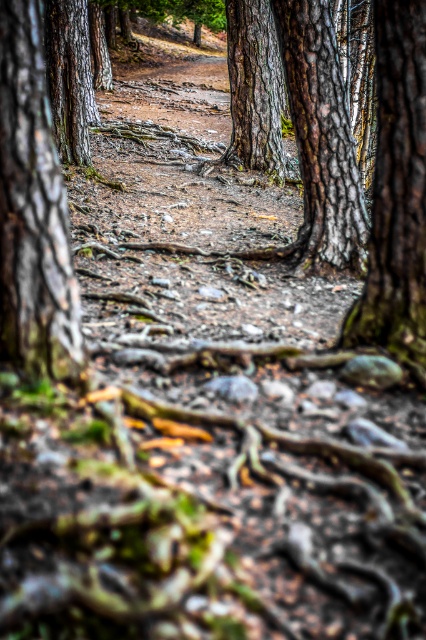
Between smooth bark tree at right and smooth bark tree at center, which one has less height?

With less height is smooth bark tree at right.

Between point (385, 144) and point (258, 49), which one is positioned in front?

Point (385, 144) is in front.

Describe the element at coordinates (397, 195) in the screenshot. This screenshot has height=640, width=426. I see `smooth bark tree at right` at that location.

In order to click on smooth bark tree at right in this screenshot , I will do `click(397, 195)`.

Is point (57, 173) behind point (371, 237)?

That is False.

Can you confirm if smooth bark tree at left is positioned to the left of smooth bark tree at right?

Indeed, smooth bark tree at left is positioned on the left side of smooth bark tree at right.

Measure the distance between smooth bark tree at left and camera.

smooth bark tree at left and camera are 7.24 feet apart from each other.

You are a GUI agent. You are given a task and a screenshot of the screen. Output one action in this format:
    pyautogui.click(x=<x>, y=<y>)
    Task: Click on the smooth bark tree at left
    
    Given the screenshot: What is the action you would take?
    pyautogui.click(x=32, y=211)

Is the position of smooth bark tree at left more distant than that of smooth bark tree at center?

No, it is not.

I want to click on smooth bark tree at left, so click(x=32, y=211).